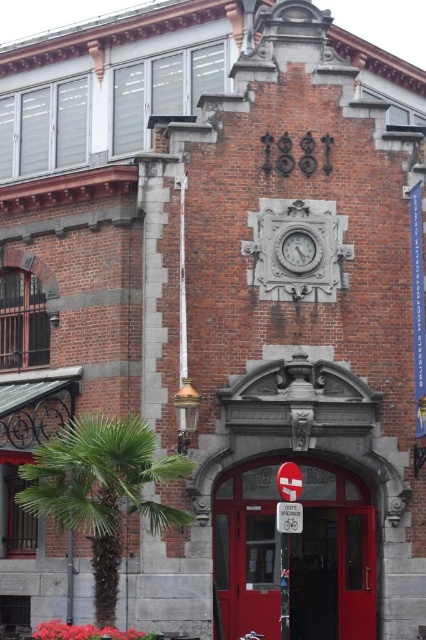
You are standing in front of the historic brick building and want to determine which of the two points, point (331, 499) or point (282, 484), is closer to you. Based on the building details provided, which point is nearer?

Point (331, 499) is closer to you because it is further to the viewer than point (282, 484).

You are a visitor approaching the entrance of the historic brick building. You notice the smooth red door at center and the metallic reflective sign at center. Which object would you see first as you walk towards the entrance?

The smooth red door at center would be seen first because the metallic reflective sign at center is positioned behind it.

You are a painter hired to paint the red plastic sign at center and the smooth red door at center. You need to know which one requires a ladder to reach its top edge. Based on the scene, which object is taller?

The red plastic sign at center is taller than the smooth red door at center, so you will need a ladder to reach the top edge of the red plastic sign at center.